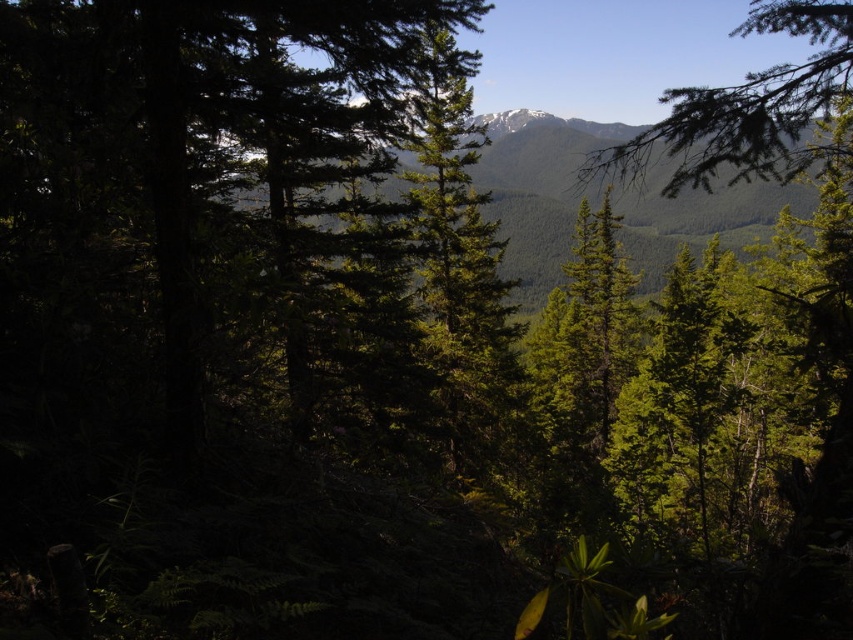
Is green textured mountain at center bigger than green matte tree branch at upper right?

No, green textured mountain at center is not bigger than green matte tree branch at upper right.

Does green textured mountain at center have a smaller size compared to green matte tree branch at upper right?

Yes, green textured mountain at center is smaller than green matte tree branch at upper right.

Image resolution: width=853 pixels, height=640 pixels. What do you see at coordinates (538, 189) in the screenshot?
I see `green textured mountain at center` at bounding box center [538, 189].

At what (x,y) coordinates should I click in order to perform the action: click on green textured mountain at center. Please return your answer as a coordinate pair (x, y). Image resolution: width=853 pixels, height=640 pixels. Looking at the image, I should click on (538, 189).